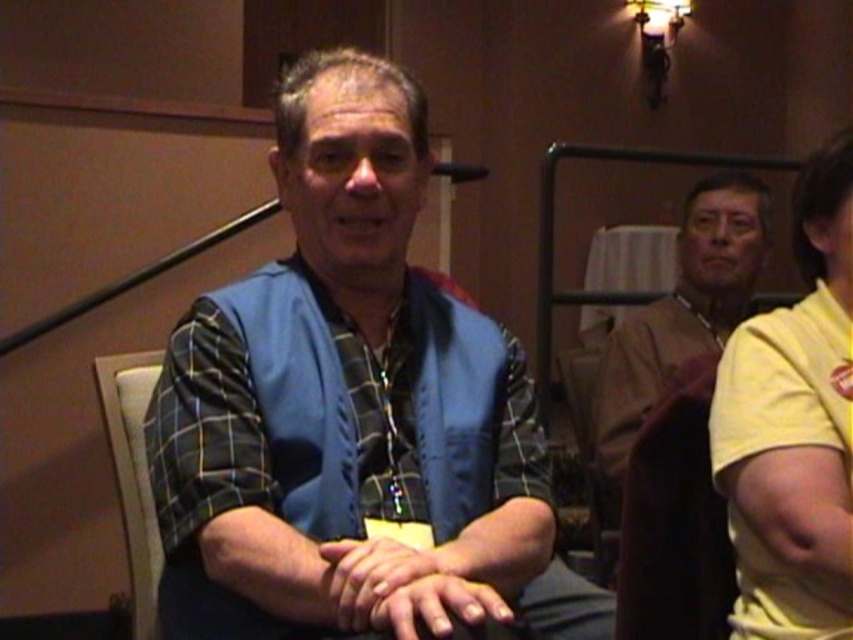
Question: Which point is farther to the camera?

Choices:
 (A) brown leather jacket at upper right
 (B) blue fabric vest at center

Answer: (A)

Question: Is blue fabric vest at center above light beige fabric chair at lower left?

Choices:
 (A) no
 (B) yes

Answer: (B)

Question: Based on their relative distances, which object is nearer to the blue fabric vest at center?

Choices:
 (A) light beige fabric chair at lower left
 (B) yellow matte shirt at right
 (C) brown leather jacket at upper right

Answer: (B)

Question: Does blue fabric vest at center appear on the left side of brown leather jacket at upper right?

Choices:
 (A) yes
 (B) no

Answer: (A)

Question: Among these points, which one is nearest to the camera?

Choices:
 (A) (734, 253)
 (B) (149, 600)

Answer: (B)

Question: Is yellow matte shirt at right to the right of light beige fabric chair at lower left from the viewer's perspective?

Choices:
 (A) yes
 (B) no

Answer: (A)